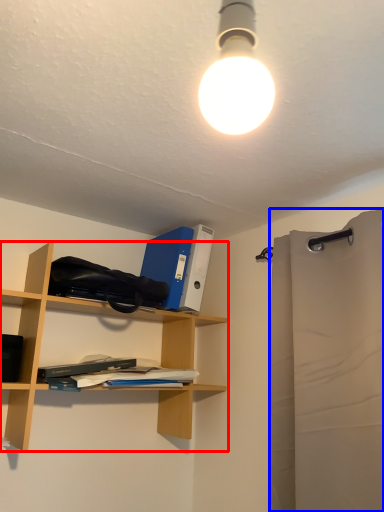
Question: Which point is further to the camera, shelf (highlighted by a red box) or shower curtain (highlighted by a blue box)?

Choices:
 (A) shelf
 (B) shower curtain

Answer: (A)